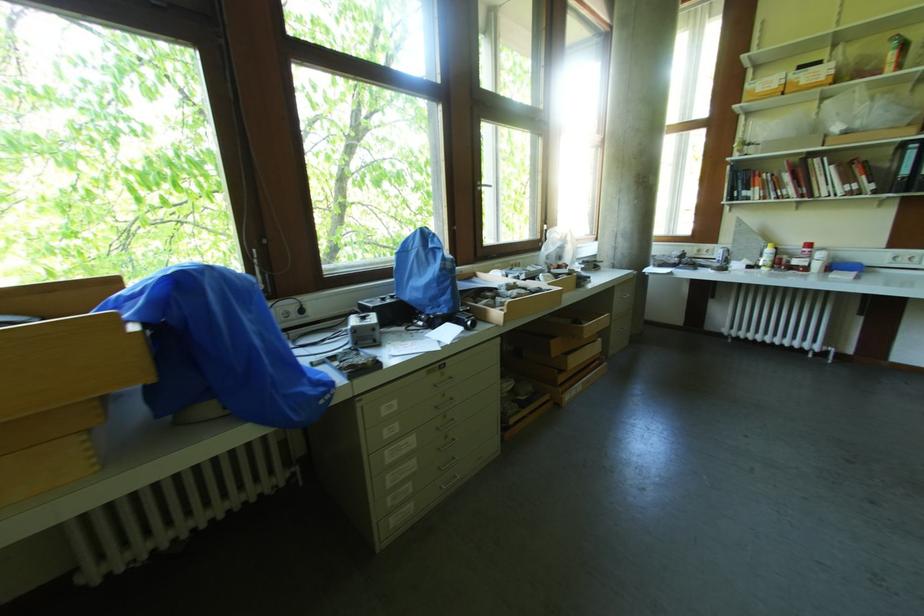
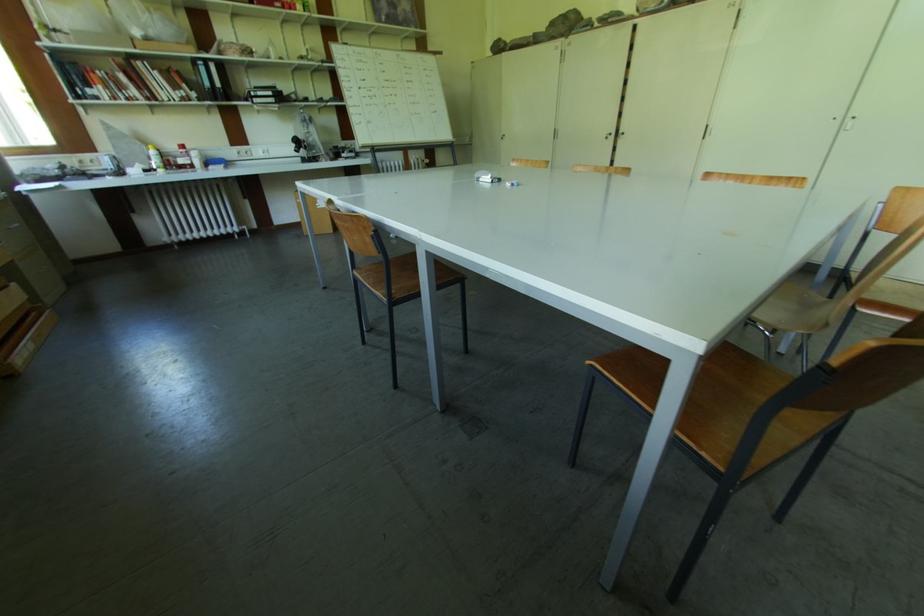
The images are taken continuously from a first-person perspective. In which direction is your viewpoint rotating?

The rotation direction of the camera is right-down.